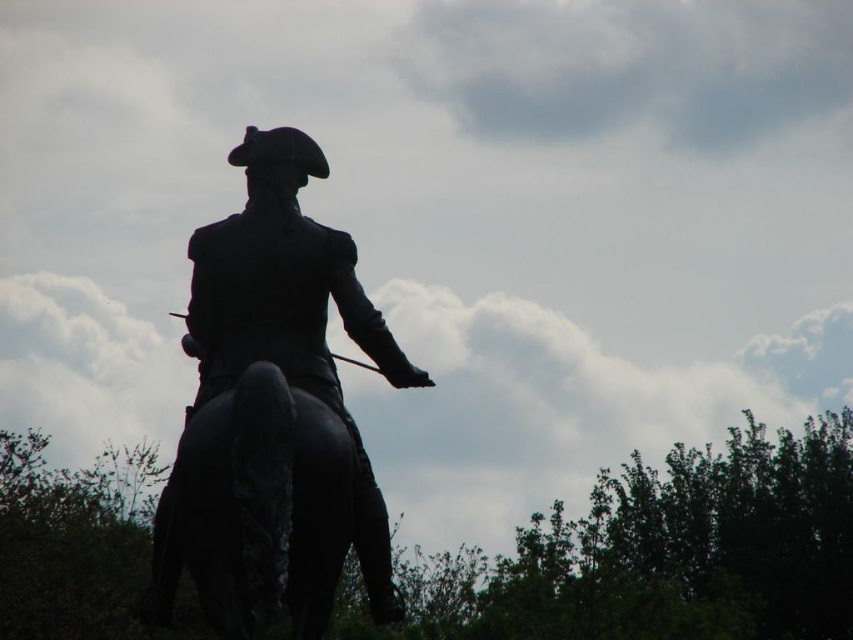
Question: Which point is closer to the camera?

Choices:
 (A) shiny black horse at center
 (B) black polished statue at center

Answer: (A)

Question: Is black polished statue at center wider than shiny black horse at center?

Choices:
 (A) no
 (B) yes

Answer: (B)

Question: Can you confirm if black polished statue at center is smaller than shiny black horse at center?

Choices:
 (A) no
 (B) yes

Answer: (A)

Question: Which of the following is the closest to the observer?

Choices:
 (A) shiny black horse at center
 (B) black polished statue at center

Answer: (A)

Question: Does black polished statue at center have a larger size compared to shiny black horse at center?

Choices:
 (A) no
 (B) yes

Answer: (B)